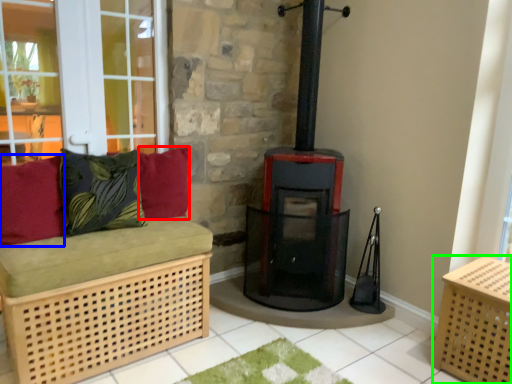
Question: Which object is the farthest from pillow (highlighted by a red box)? Choose among these: pillow (highlighted by a blue box) or crate (highlighted by a green box).

Choices:
 (A) pillow
 (B) crate

Answer: (B)